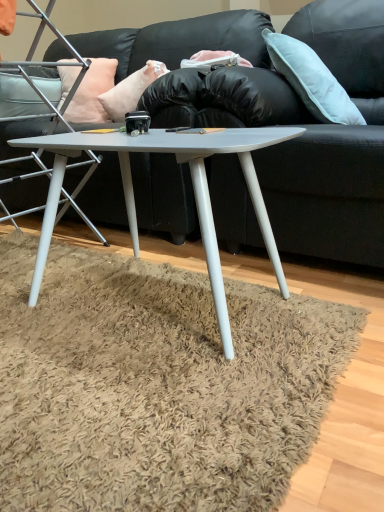
Question: From the image's perspective, is light blue fabric pillow at upper right, the first pillow from the right, over peachy fabric pillow at upper left, the third pillow when ordered from right to left?

Choices:
 (A) yes
 (B) no

Answer: (B)

Question: Is peachy fabric pillow at upper left, the 1th pillow positioned from the left, surrounded by light blue fabric pillow at upper right, which is counted as the third pillow, starting from the left?

Choices:
 (A) yes
 (B) no

Answer: (B)

Question: Can you confirm if light blue fabric pillow at upper right, the first pillow from the right, is wider than peachy fabric pillow at upper left, the third pillow when ordered from right to left?

Choices:
 (A) no
 (B) yes

Answer: (B)

Question: Can you confirm if light blue fabric pillow at upper right, the first pillow from the right, is smaller than peachy fabric pillow at upper left, the third pillow when ordered from right to left?

Choices:
 (A) no
 (B) yes

Answer: (A)

Question: Can you see light blue fabric pillow at upper right, the first pillow from the right, touching peachy fabric pillow at upper left, the 1th pillow positioned from the left?

Choices:
 (A) no
 (B) yes

Answer: (A)

Question: From a real-world perspective, is light blue fabric pillow at upper right, which is counted as the third pillow, starting from the left, positioned above or below black leather couch at center?

Choices:
 (A) below
 (B) above

Answer: (B)

Question: In terms of width, does light blue fabric pillow at upper right, which is counted as the third pillow, starting from the left, look wider or thinner when compared to black leather couch at center?

Choices:
 (A) thin
 (B) wide

Answer: (A)

Question: Would you say light blue fabric pillow at upper right, the first pillow from the right, is to the left or to the right of black leather couch at center in the picture?

Choices:
 (A) left
 (B) right

Answer: (A)

Question: From the image's perspective, is light blue fabric pillow at upper right, which is counted as the third pillow, starting from the left, located above or below black leather couch at center?

Choices:
 (A) below
 (B) above

Answer: (B)

Question: Is metallic silver chair at left inside the boundaries of light blue fabric pillow at upper right, the first pillow from the right, or outside?

Choices:
 (A) outside
 (B) inside

Answer: (A)

Question: Is metallic silver chair at left taller or shorter than light blue fabric pillow at upper right, which is counted as the third pillow, starting from the left?

Choices:
 (A) short
 (B) tall

Answer: (B)

Question: In terms of size, does metallic silver chair at left appear bigger or smaller than light blue fabric pillow at upper right, the first pillow from the right?

Choices:
 (A) small
 (B) big

Answer: (B)

Question: In the image, is metallic silver chair at left positioned in front of or behind light blue fabric pillow at upper right, which is counted as the third pillow, starting from the left?

Choices:
 (A) behind
 (B) front

Answer: (B)

Question: From a real-world perspective, is matte gray coffee table at center physically located above or below metallic silver chair at left?

Choices:
 (A) below
 (B) above

Answer: (A)

Question: From the image's perspective, relative to metallic silver chair at left, is matte gray coffee table at center above or below?

Choices:
 (A) above
 (B) below

Answer: (B)